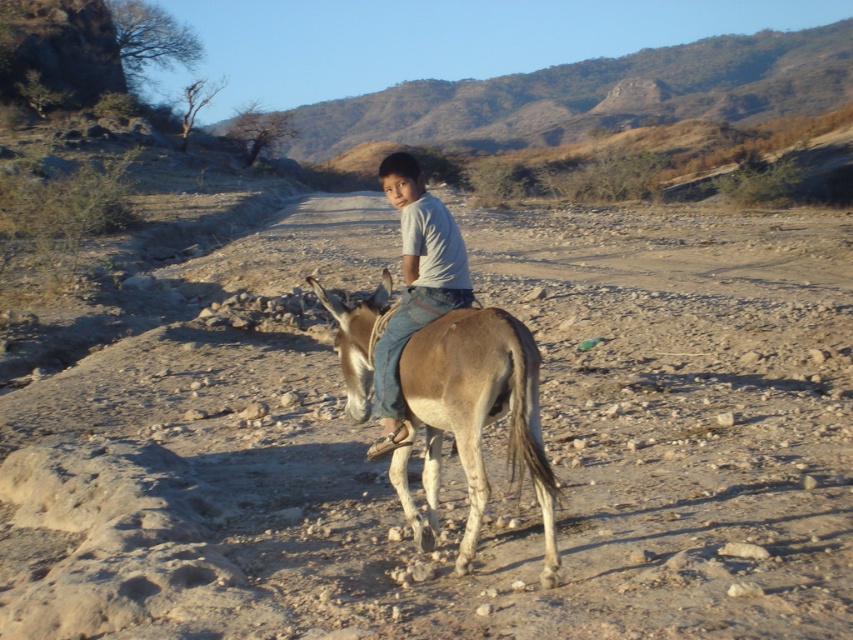
Question: Is brown sandy ground at center thinner than light blue denim jeans at center?

Choices:
 (A) yes
 (B) no

Answer: (B)

Question: Does brown sandy ground at center appear under light brown textured mule at center?

Choices:
 (A) no
 (B) yes

Answer: (A)

Question: Among these points, which one is farthest from the camera?

Choices:
 (A) (315, 332)
 (B) (427, 484)
 (C) (424, 209)

Answer: (A)

Question: Which point is farther to the camera?

Choices:
 (A) brown sandy ground at center
 (B) light brown textured mule at center
 (C) light blue denim jeans at center

Answer: (C)

Question: Which point is closer to the camera taking this photo?

Choices:
 (A) (444, 368)
 (B) (407, 202)
 (C) (68, 566)

Answer: (A)

Question: Does brown sandy ground at center lie in front of light blue denim jeans at center?

Choices:
 (A) yes
 (B) no

Answer: (A)